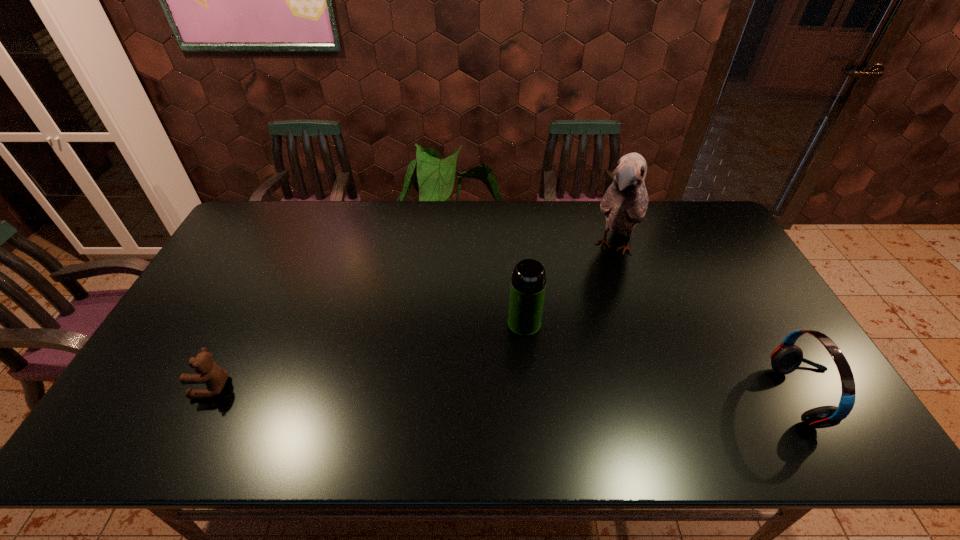
Select which object is the second closest to the second object from right to left. Please provide its 2D coordinates. Your answer should be formatted as a tuple, i.e. [(x, y)], where the tuple contains the x and y coordinates of a point satisfying the conditions above.

[(785, 359)]

Locate an element on the screen. free space that satisfies the following two spatial constraints: 1. on the front side of the third tallest object; 2. with the microphone attached to the side of the third shortest object is located at coordinates (531, 397).

Find the location of `vacant point that satisfies the following two spatial constraints: 1. on the front side of the headset; 2. with the microphone attached to the side of the second tallest object`. vacant point that satisfies the following two spatial constraints: 1. on the front side of the headset; 2. with the microphone attached to the side of the second tallest object is located at coordinates point(531,397).

Find the location of `free space that satisfies the following two spatial constraints: 1. on the front side of the third shortest object; 2. with the microphone attached to the side of the rightmost object`. free space that satisfies the following two spatial constraints: 1. on the front side of the third shortest object; 2. with the microphone attached to the side of the rightmost object is located at coordinates (531, 397).

This screenshot has height=540, width=960. What are the coordinates of `vacant region that satisfies the following two spatial constraints: 1. on the front side of the rightmost object; 2. with the microphone attached to the side of the parrot` in the screenshot? It's located at (666, 397).